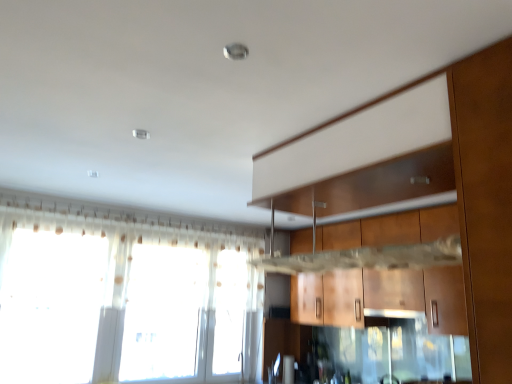
Question: Considering the relative positions of translucent fabric window at lower left and wooden cabinet at center in the image provided, is translucent fabric window at lower left behind wooden cabinet at center?

Choices:
 (A) yes
 (B) no

Answer: (A)

Question: Can you confirm if translucent fabric window at lower left is thinner than wooden cabinet at center?

Choices:
 (A) yes
 (B) no

Answer: (A)

Question: Can you confirm if translucent fabric window at lower left is bigger than wooden cabinet at center?

Choices:
 (A) no
 (B) yes

Answer: (B)

Question: Is translucent fabric window at lower left oriented away from wooden cabinet at center?

Choices:
 (A) yes
 (B) no

Answer: (B)

Question: Is translucent fabric window at lower left to the left of wooden cabinet at center from the viewer's perspective?

Choices:
 (A) yes
 (B) no

Answer: (A)

Question: Is translucent fabric window at lower left positioned beyond the bounds of wooden cabinet at center?

Choices:
 (A) yes
 (B) no

Answer: (A)

Question: Is matte white exhaust hood at center to the left of translucent fabric window at lower left from the viewer's perspective?

Choices:
 (A) no
 (B) yes

Answer: (A)

Question: Is matte white exhaust hood at center looking in the opposite direction of translucent fabric window at lower left?

Choices:
 (A) yes
 (B) no

Answer: (B)

Question: From a real-world perspective, does matte white exhaust hood at center sit lower than translucent fabric window at lower left?

Choices:
 (A) yes
 (B) no

Answer: (A)

Question: Is the position of matte white exhaust hood at center more distant than that of translucent fabric window at lower left?

Choices:
 (A) yes
 (B) no

Answer: (A)

Question: Considering the relative sizes of matte white exhaust hood at center and translucent fabric window at lower left in the image provided, is matte white exhaust hood at center thinner than translucent fabric window at lower left?

Choices:
 (A) yes
 (B) no

Answer: (B)

Question: From the image's perspective, does matte white exhaust hood at center appear lower than translucent fabric window at lower left?

Choices:
 (A) yes
 (B) no

Answer: (A)

Question: Is translucent fabric window at lower left facing towards matte white exhaust hood at center?

Choices:
 (A) no
 (B) yes

Answer: (B)